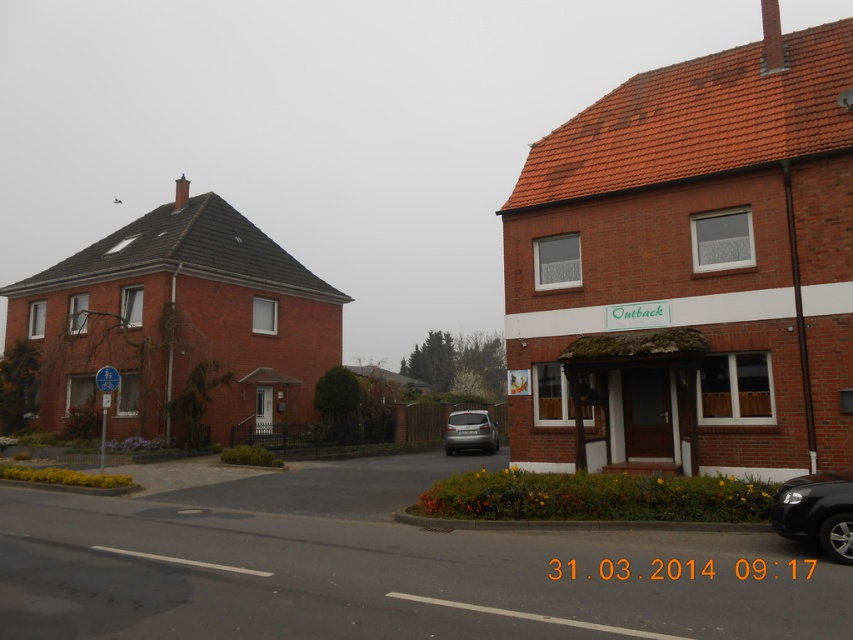
Question: Which object appears farthest from the camera in this image?

Choices:
 (A) satin silver car at center
 (B) shiny black car at lower right

Answer: (A)

Question: In this image, where is shiny black car at lower right located relative to satin silver car at center?

Choices:
 (A) below
 (B) above

Answer: (B)

Question: Considering the relative positions of shiny black car at lower right and satin silver car at center in the image provided, where is shiny black car at lower right located with respect to satin silver car at center?

Choices:
 (A) above
 (B) below

Answer: (A)

Question: Can you confirm if shiny black car at lower right is positioned to the left of satin silver car at center?

Choices:
 (A) no
 (B) yes

Answer: (A)

Question: Which of the following is the farthest from the observer?

Choices:
 (A) (447, 422)
 (B) (846, 554)

Answer: (A)